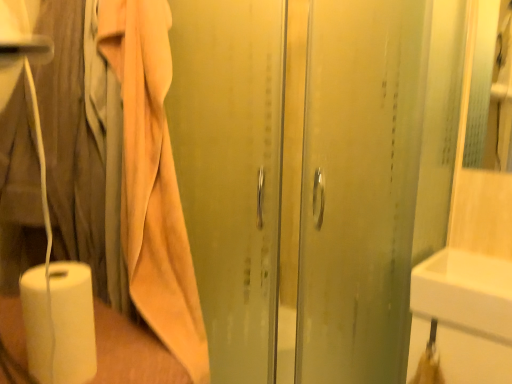
What do you see at coordinates (153, 181) in the screenshot?
I see `beige cotton bath towel at left` at bounding box center [153, 181].

You are a GUI agent. You are given a task and a screenshot of the screen. Output one action in this format:
    pyautogui.click(x=<x>, y=<y>)
    Task: Click on the white glossy sink at lower right
    
    Given the screenshot: What is the action you would take?
    pyautogui.click(x=465, y=293)

Is beige cotton bath towel at left next to transparent glass shower door at center and touching it?

beige cotton bath towel at left and transparent glass shower door at center are clearly separated.

Is beige cotton bath towel at left to the left or to the right of transparent glass shower door at center in the image?

Based on their positions, beige cotton bath towel at left is located to the left of transparent glass shower door at center.

Is beige cotton bath towel at left oriented away from transparent glass shower door at center?

No, beige cotton bath towel at left is not facing away from transparent glass shower door at center.

I want to click on screen door located below the beige cotton bath towel at left (from the image's perspective), so tap(231, 172).

Considering the positions of objects transparent glass shower door at center and beige cotton bath towel at left in the image provided, who is behind, transparent glass shower door at center or beige cotton bath towel at left?

transparent glass shower door at center is further away from the camera.

Which is closer to the camera, (212, 72) or (133, 246)?

Point (133, 246)

In order to click on bath towel located in front of the transparent glass shower door at center in this screenshot , I will do `click(153, 181)`.

From a real-world perspective, is transparent glass shower door at center physically above beige cotton bath towel at left?

No.

Considering the relative sizes of transparent glass shower door at center and white glossy sink at lower right in the image provided, is transparent glass shower door at center taller than white glossy sink at lower right?

Yes, transparent glass shower door at center is taller than white glossy sink at lower right.

Which is further, (209, 16) or (505, 337)?

The point (505, 337) is more distant.

Image resolution: width=512 pixels, height=384 pixels. I want to click on screen door on the left of white glossy sink at lower right, so click(231, 172).

From a real-world perspective, which object stands above the other?

beige cotton bath towel at left, from a real-world perspective.

Is beige cotton bath towel at left inside or outside of white matte paper towel at lower left?

beige cotton bath towel at left is outside white matte paper towel at lower left.

Measure the distance between beige cotton bath towel at left and white matte paper towel at lower left.

beige cotton bath towel at left is 11.61 inches away from white matte paper towel at lower left.

In terms of size, does beige cotton bath towel at left appear bigger or smaller than white matte paper towel at lower left?

In the image, beige cotton bath towel at left appears to be larger than white matte paper towel at lower left.

Is transparent glass shower door at center taller than white matte paper towel at lower left?

Yes.

Between transparent glass shower door at center and white matte paper towel at lower left, which one has smaller width?

Thinner between the two is white matte paper towel at lower left.

How much distance is there between transparent glass shower door at center and white matte paper towel at lower left?

A distance of 17.81 inches exists between transparent glass shower door at center and white matte paper towel at lower left.

Considering the points (266, 69) and (56, 321), which point is in front, point (266, 69) or point (56, 321)?

The point (56, 321) is closer to the camera.

From a real-world perspective, is white glossy sink at lower right positioned above or below beige cotton bath towel at left?

white glossy sink at lower right is below beige cotton bath towel at left.

Is white glossy sink at lower right facing away from beige cotton bath towel at left?

No, white glossy sink at lower right is not facing the opposite direction of beige cotton bath towel at left.

Who is smaller, white glossy sink at lower right or beige cotton bath towel at left?

With smaller size is white glossy sink at lower right.

In the scene shown: Would you say white glossy sink at lower right is part of beige cotton bath towel at left's contents?

Actually, white glossy sink at lower right is outside beige cotton bath towel at left.

Find the location of a particular element. bath towel on the left of white glossy sink at lower right is located at coordinates (153, 181).

From the image's perspective, is beige cotton bath towel at left above white glossy sink at lower right?

Correct, beige cotton bath towel at left appears higher than white glossy sink at lower right in the image.

Is point (129, 47) closer to viewer compared to point (454, 322)?

That is True.

Identify the location of screen door behind the beige cotton bath towel at left. (231, 172).

In order to click on screen door on the right of beige cotton bath towel at left in this screenshot , I will do `click(231, 172)`.

Based on the photo, when comparing their distances from white glossy sink at lower right, does beige cotton bath towel at left or transparent glass shower door at center seem further?

Based on the image, beige cotton bath towel at left appears to be further to white glossy sink at lower right.

Based on their spatial positions, is beige cotton bath towel at left or white matte paper towel at lower left closer to white glossy sink at lower right?

beige cotton bath towel at left is positioned closer to the anchor white glossy sink at lower right.

Estimate the real-world distances between objects in this image. Which object is further from transparent glass shower door at center, white glossy sink at lower right or beige cotton bath towel at left?

white glossy sink at lower right.

Considering their positions, is white glossy sink at lower right positioned closer to white matte paper towel at lower left than beige cotton bath towel at left?

beige cotton bath towel at left is closer to white matte paper towel at lower left.

Estimate the real-world distances between objects in this image. Which object is closer to white glossy sink at lower right, white matte paper towel at lower left or transparent glass shower door at center?

Among the two, transparent glass shower door at center is located nearer to white glossy sink at lower right.

Estimate the real-world distances between objects in this image. Which object is closer to white glossy sink at lower right, white matte paper towel at lower left or beige cotton bath towel at left?

beige cotton bath towel at left lies closer to white glossy sink at lower right than the other object.

Which object lies further to the anchor point white matte paper towel at lower left, transparent glass shower door at center or beige cotton bath towel at left?

transparent glass shower door at center is positioned further to the anchor white matte paper towel at lower left.

Considering their positions, is transparent glass shower door at center positioned closer to white matte paper towel at lower left than white glossy sink at lower right?

Among the two, transparent glass shower door at center is located nearer to white matte paper towel at lower left.

In order to click on screen door between beige cotton bath towel at left and white matte paper towel at lower left in the up-down direction in this screenshot , I will do `click(231, 172)`.

Locate an element on the screen. This screenshot has height=384, width=512. screen door between white matte paper towel at lower left and white glossy sink at lower right from left to right is located at coordinates (231, 172).

Locate an element on the screen. screen door between beige cotton bath towel at left and white glossy sink at lower right in the horizontal direction is located at coordinates (231, 172).

This screenshot has width=512, height=384. I want to click on bath towel between white matte paper towel at lower left and white glossy sink at lower right, so click(153, 181).